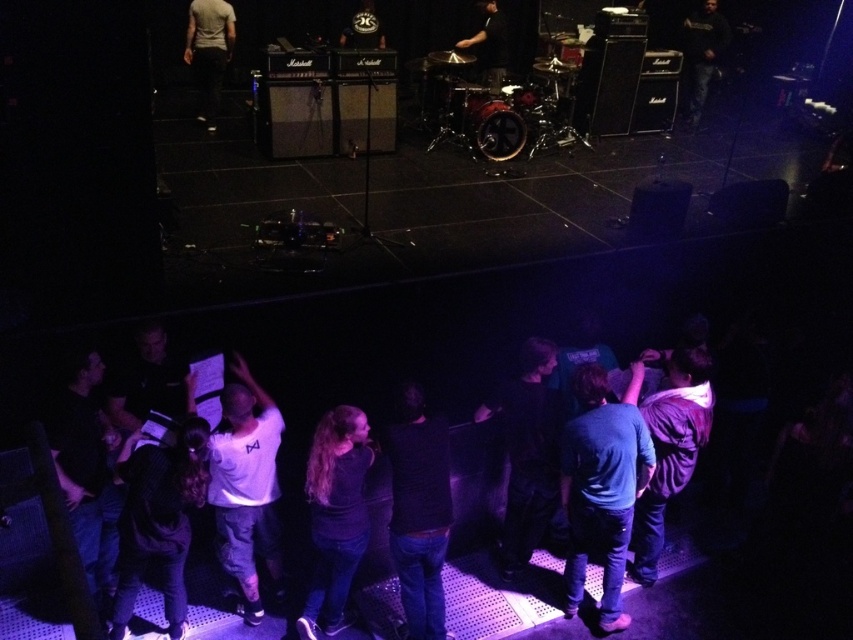
Can you confirm if blue denim jeans at lower right is wider than white matte shirt at upper left?

No, blue denim jeans at lower right is not wider than white matte shirt at upper left.

Can you confirm if blue denim jeans at lower right is positioned to the right of white matte shirt at upper left?

Indeed, blue denim jeans at lower right is positioned on the right side of white matte shirt at upper left.

Which is in front, point (608, 451) or point (215, 99)?

Positioned in front is point (608, 451).

You are a GUI agent. You are given a task and a screenshot of the screen. Output one action in this format:
    pyautogui.click(x=<x>, y=<y>)
    Task: Click on the blue denim jeans at lower right
    
    Given the screenshot: What is the action you would take?
    pyautogui.click(x=601, y=490)

Between blue denim jeans at lower right and dark brown leather drumsticks at upper center, which one is positioned lower?

blue denim jeans at lower right is below.

Who is positioned more to the right, blue denim jeans at lower right or dark brown leather drumsticks at upper center?

blue denim jeans at lower right is more to the right.

Which is in front, point (582, 499) or point (486, 4)?

Point (582, 499) is in front.

Where is `blue denim jeans at lower right`? The image size is (853, 640). blue denim jeans at lower right is located at coordinates (601, 490).

Is black matte shirt at lower left bigger than dark brown leather drumsticks at upper center?

Incorrect, black matte shirt at lower left is not larger than dark brown leather drumsticks at upper center.

This screenshot has height=640, width=853. Describe the element at coordinates (86, 472) in the screenshot. I see `black matte shirt at lower left` at that location.

Who is more forward, (108, 596) or (490, 36)?

Point (108, 596) is in front.

Find the location of a particular element. This screenshot has height=640, width=853. black matte shirt at lower left is located at coordinates (86, 472).